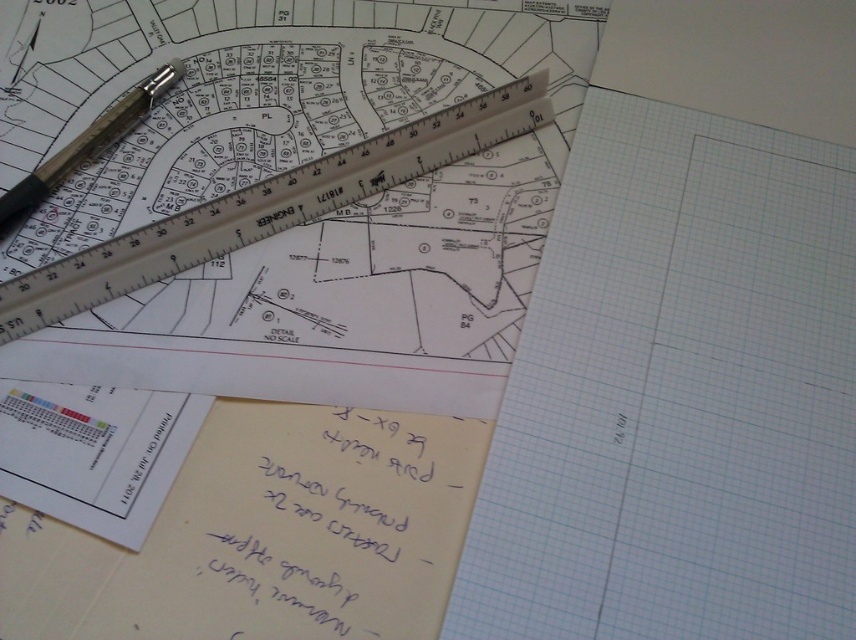
You are an architect working on a project and need to place a new blueprint that requires 40 centimeters of space between the white grid paper at center and the metallic silver ruler at upper center. Is there enough space between them to accommodate this requirement?

The white grid paper at center is 37.62 centimeters away from the metallic silver ruler at upper center. Since the required space is 40 centimeters, there isn not enough space between them to accommodate the new blueprint.

You need to place a new object on the workspace. The object requires a surface area larger than the metallic silver ruler at upper center. Can the white grid paper at center accommodate it?

The white grid paper at center is larger in size than the metallic silver ruler at upper center, so it can accommodate the new object requiring a surface area larger than the ruler.